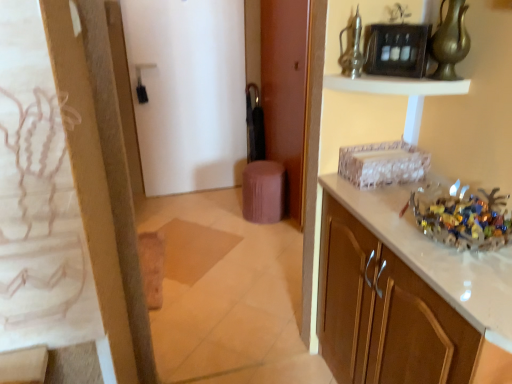
I want to click on free space that is to the left of purple fabric stool at center, so click(x=225, y=220).